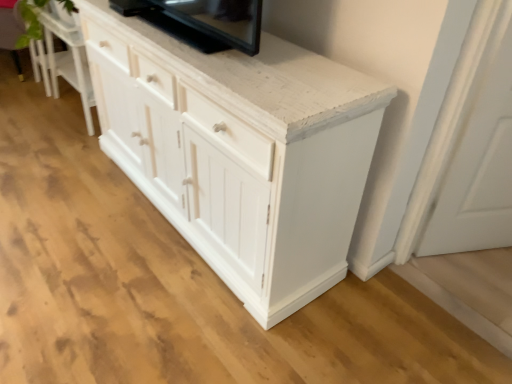
Question: From a real-world perspective, is white matte door at lower right located beneath white wood cabinet at lower left?

Choices:
 (A) yes
 (B) no

Answer: (B)

Question: Is white matte door at lower right wider than white wood cabinet at lower left?

Choices:
 (A) no
 (B) yes

Answer: (A)

Question: Is white matte door at lower right oriented towards white wood cabinet at lower left?

Choices:
 (A) yes
 (B) no

Answer: (B)

Question: Is white matte door at lower right shorter than white wood cabinet at lower left?

Choices:
 (A) yes
 (B) no

Answer: (B)

Question: Is white matte door at lower right not within white wood cabinet at lower left?

Choices:
 (A) no
 (B) yes

Answer: (B)

Question: Is green leafy plant at upper left inside or outside of black glossy tv at upper center?

Choices:
 (A) outside
 (B) inside

Answer: (A)

Question: In the image, is green leafy plant at upper left positioned in front of or behind black glossy tv at upper center?

Choices:
 (A) front
 (B) behind

Answer: (B)

Question: From a real-world perspective, is green leafy plant at upper left positioned above or below black glossy tv at upper center?

Choices:
 (A) below
 (B) above

Answer: (A)

Question: Would you say green leafy plant at upper left is to the left or to the right of black glossy tv at upper center in the picture?

Choices:
 (A) left
 (B) right

Answer: (A)

Question: Does point (128, 16) appear closer or farther from the camera than point (464, 248)?

Choices:
 (A) farther
 (B) closer

Answer: (B)

Question: Based on their sizes in the image, would you say black glossy tv at upper center is bigger or smaller than white matte door at lower right?

Choices:
 (A) small
 (B) big

Answer: (A)

Question: Considering the positions of black glossy tv at upper center and white matte door at lower right in the image, is black glossy tv at upper center wider or thinner than white matte door at lower right?

Choices:
 (A) wide
 (B) thin

Answer: (A)

Question: Based on their positions, is black glossy tv at upper center located to the left or right of white matte door at lower right?

Choices:
 (A) right
 (B) left

Answer: (B)

Question: In terms of width, does white wood cabinet at lower left look wider or thinner when compared to white matte door at lower right?

Choices:
 (A) wide
 (B) thin

Answer: (A)

Question: Is point (52, 69) positioned closer to the camera than point (499, 185)?

Choices:
 (A) farther
 (B) closer

Answer: (A)